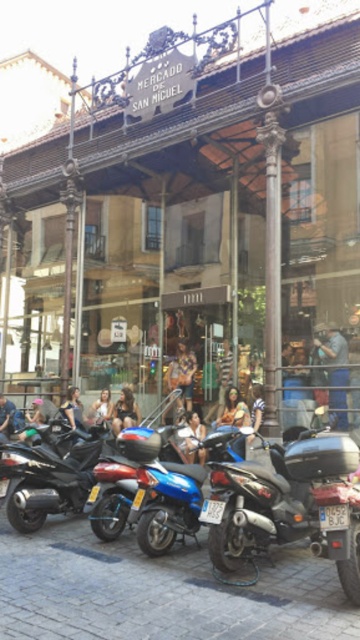
You are a tourist standing in front of the entrance to Mercado de San Miguel. You see a blue leather jacket at center and a blue leather jacket at lower left. Which one is closer to the entrance?

The blue leather jacket at center is closer to the entrance because it is positioned below the blue leather jacket at lower left, meaning it is lower in the image and thus nearer to the entrance.

You are standing at the entrance of Mercado de San Miguel in Madrid. You see two points marked on the pavement in front of you. The first point is at coordinate point (x=276, y=470) and the second is at point (x=249, y=422). Which point is closer to you?

Point (x=276, y=470) is closer to the viewer than point (x=249, y=422).